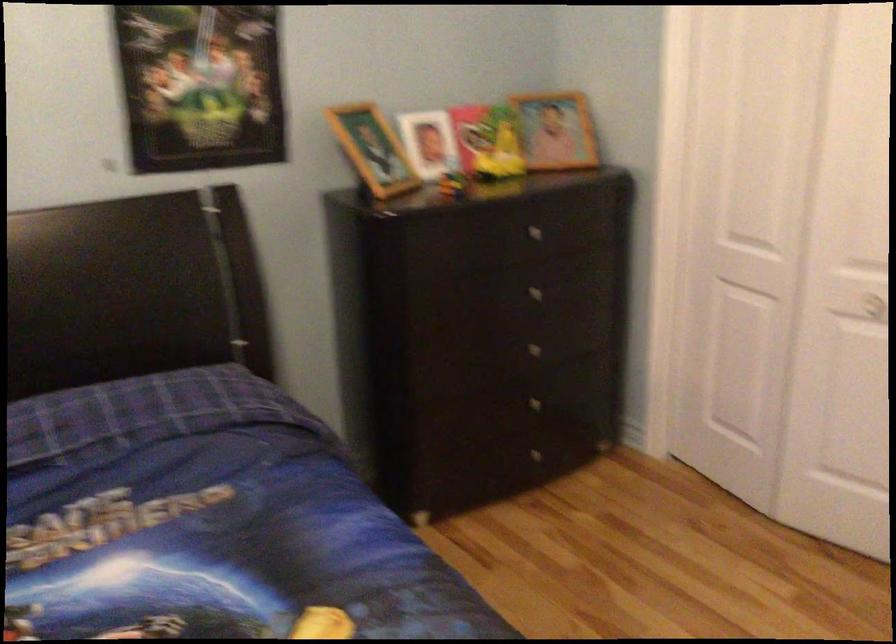
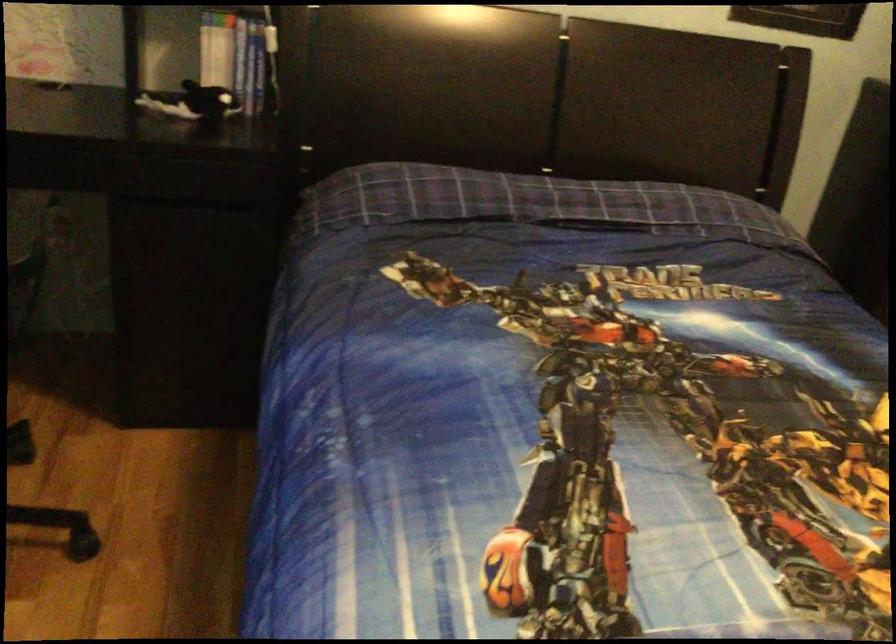
Which direction would the cameraman need to move to produce the second image?

The cameraman moved toward left, backward.